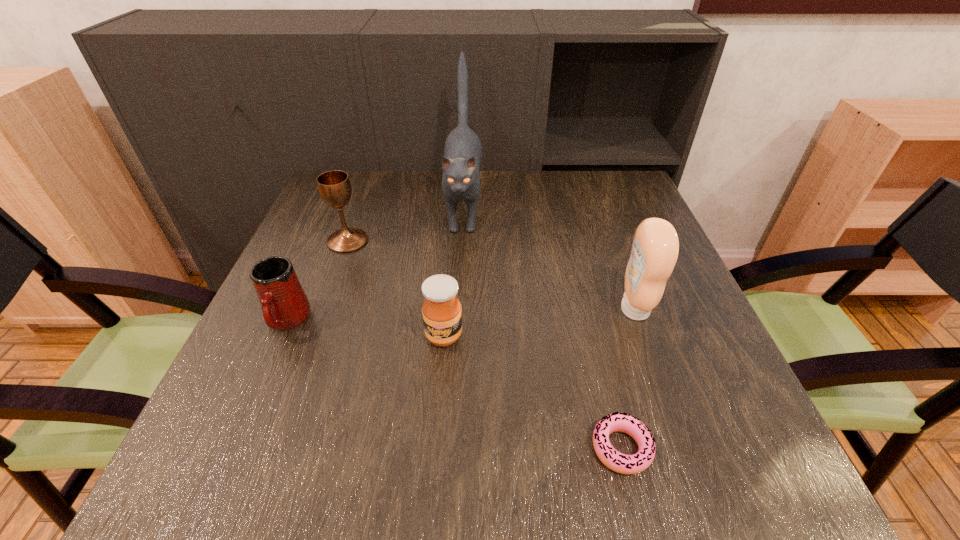
Where is `vacant point located between the mug and the second object from right to left`? vacant point located between the mug and the second object from right to left is located at coordinates (454, 384).

The height and width of the screenshot is (540, 960). Find the location of `vacant point located between the doughnut and the fourth shortest object`. vacant point located between the doughnut and the fourth shortest object is located at coordinates (485, 345).

Where is `free space that is in between the cat and the shortest object`? The width and height of the screenshot is (960, 540). free space that is in between the cat and the shortest object is located at coordinates (542, 328).

Locate an element on the screen. This screenshot has width=960, height=540. free area in between the mug and the doughnut is located at coordinates (454, 384).

Locate an element on the screen. vacant space that is in between the mug and the tallest object is located at coordinates (375, 265).

You are a GUI agent. You are given a task and a screenshot of the screen. Output one action in this format:
    pyautogui.click(x=<x>, y=<y>)
    Task: Click on the vacant area between the tallest object and the mug
    This screenshot has height=540, width=960.
    Given the screenshot: What is the action you would take?
    pyautogui.click(x=375, y=265)

At what (x,y) coordinates should I click in order to perform the action: click on vacant space that's between the tallest object and the fourth shortest object. Please return your answer as a coordinate pair (x, y). The height and width of the screenshot is (540, 960). Looking at the image, I should click on (405, 224).

This screenshot has height=540, width=960. Identify the location of object that is the nearest to the doughnut. (655, 248).

This screenshot has height=540, width=960. In order to click on object identified as the second closest to the cat in this screenshot , I will do `click(442, 316)`.

Locate an element on the screen. vacant area that satisfies the following two spatial constraints: 1. on the side of the mug with the handle; 2. on the right side of the nearest object is located at coordinates (232, 448).